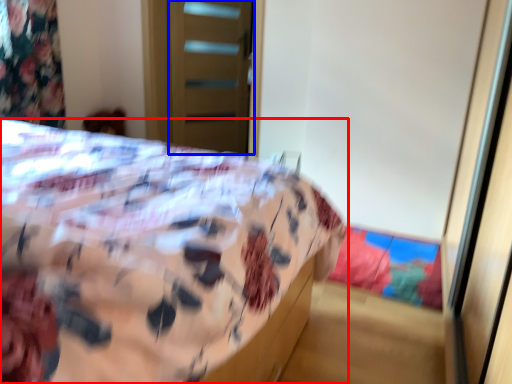
Question: Among these objects, which one is farthest to the camera, bed (highlighted by a red box) or screen door (highlighted by a blue box)?

Choices:
 (A) bed
 (B) screen door

Answer: (B)